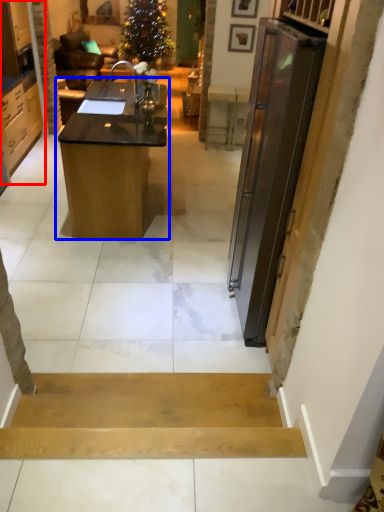
Question: Which object appears farthest to the camera in this image, cabinetry (highlighted by a red box) or desk (highlighted by a blue box)?

Choices:
 (A) cabinetry
 (B) desk

Answer: (A)